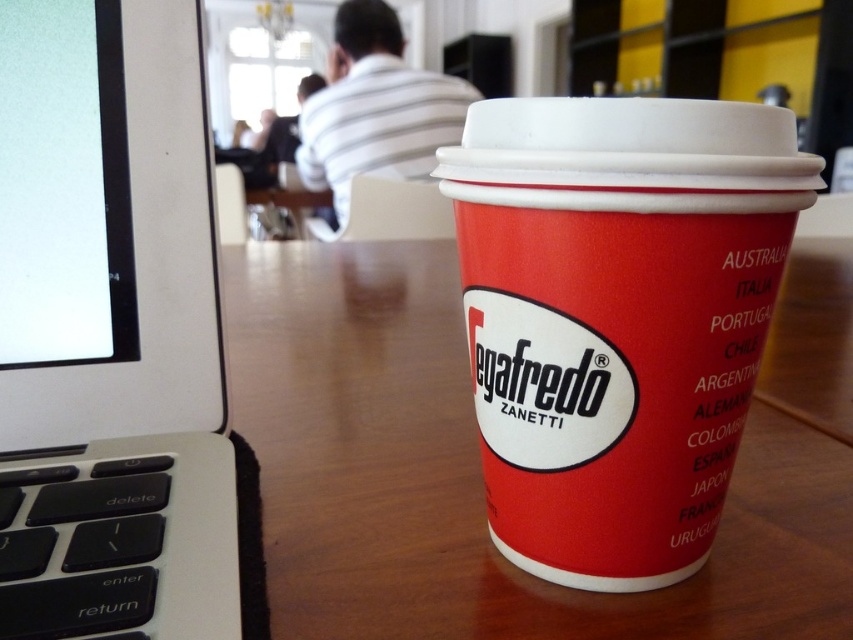
Who is positioned more to the right, wooden table at center or red matte segafredo cup at center?

wooden table at center

Can you confirm if wooden table at center is wider than red matte segafredo cup at center?

Yes.

The image size is (853, 640). I want to click on wooden table at center, so click(479, 465).

Locate an element on the screen. wooden table at center is located at coordinates (479, 465).

What do you see at coordinates (479, 465) in the screenshot?
I see `wooden table at center` at bounding box center [479, 465].

Who is more forward, (x=404, y=506) or (x=0, y=228)?

Point (x=0, y=228)

Locate an element on the screen. Image resolution: width=853 pixels, height=640 pixels. wooden table at center is located at coordinates (479, 465).

Between white plastic laptop at left and red matte segafredo cup at center, which one has less height?

Standing shorter between the two is red matte segafredo cup at center.

Identify the location of white plastic laptop at left. This screenshot has width=853, height=640. (109, 328).